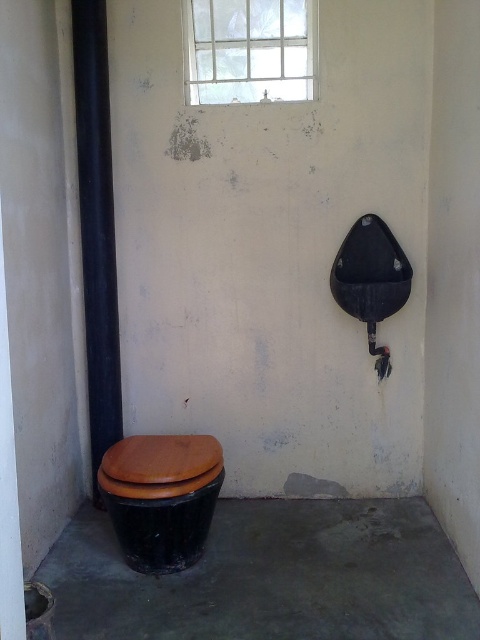
The image size is (480, 640). I want to click on black matte cement at lower left, so click(x=272, y=577).

At what (x,y) coordinates should I click in order to perform the action: click on black matte cement at lower left. Please return your answer as a coordinate pair (x, y). Looking at the image, I should click on (272, 577).

Can you confirm if black glossy toilet bowl at lower left is positioned to the right of brown matte toilet lid at lower left?

Incorrect, black glossy toilet bowl at lower left is not on the right side of brown matte toilet lid at lower left.

The height and width of the screenshot is (640, 480). Describe the element at coordinates (162, 497) in the screenshot. I see `black glossy toilet bowl at lower left` at that location.

Is point (121, 536) more distant than point (137, 442)?

No, it is in front of (137, 442).

At what (x,y) coordinates should I click in order to perform the action: click on black glossy toilet bowl at lower left. Please return your answer as a coordinate pair (x, y). The height and width of the screenshot is (640, 480). Looking at the image, I should click on (162, 497).

Is black glossy toilet bowl at lower left to the left of clear glass window at upper center from the viewer's perspective?

Indeed, black glossy toilet bowl at lower left is positioned on the left side of clear glass window at upper center.

In the scene shown: Which is more to the right, black glossy toilet bowl at lower left or clear glass window at upper center?

From the viewer's perspective, clear glass window at upper center appears more on the right side.

Which is behind, point (118, 492) or point (314, 52)?

The point (314, 52) is behind.

Identify the location of black glossy toilet bowl at lower left. (162, 497).